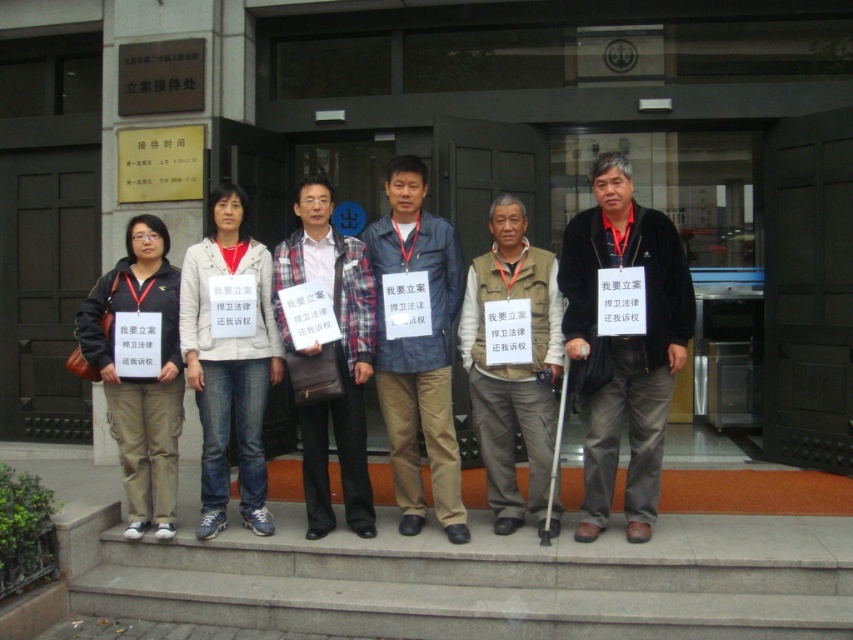
Question: Does dark gray pants at center appear on the left side of dark blue leather jacket at center?

Choices:
 (A) yes
 (B) no

Answer: (B)

Question: In this image, where is dark blue leather jacket at center located relative to plaid fabric shirt at center?

Choices:
 (A) left
 (B) right

Answer: (B)

Question: Which of the following is the closest to the observer?

Choices:
 (A) dark gray pants at center
 (B) matte black jacket at left
 (C) brown vest at center
 (D) denim jeans at center

Answer: (A)

Question: Which point appears farthest from the camera in this image?

Choices:
 (A) (329, 225)
 (B) (585, 262)
 (C) (549, 324)

Answer: (A)

Question: Which object appears closest to the camera in this image?

Choices:
 (A) dark gray pants at center
 (B) denim jeans at center
 (C) dark blue leather jacket at center
 (D) plaid fabric shirt at center

Answer: (A)

Question: Does dark gray pants at center come in front of denim jeans at center?

Choices:
 (A) no
 (B) yes

Answer: (B)